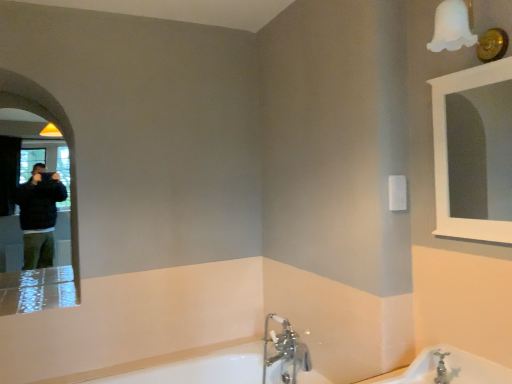
Question: Does white frosted glass light fixture at upper right contain white porcelain bathtub at lower right, the first bath from the top?

Choices:
 (A) no
 (B) yes

Answer: (A)

Question: Is white frosted glass light fixture at upper right looking in the opposite direction of white porcelain bathtub at lower right, placed as the 1th bath when sorted from right to left?

Choices:
 (A) yes
 (B) no

Answer: (B)

Question: Is white frosted glass light fixture at upper right in front of white porcelain bathtub at lower right, placed as the 1th bath when sorted from right to left?

Choices:
 (A) no
 (B) yes

Answer: (A)

Question: Is white frosted glass light fixture at upper right far away from white porcelain bathtub at lower right, positioned as the 1th bath in front-to-back order?

Choices:
 (A) yes
 (B) no

Answer: (A)

Question: From a real-world perspective, is white frosted glass light fixture at upper right physically below white porcelain bathtub at lower right, the 2th bath viewed from the back?

Choices:
 (A) no
 (B) yes

Answer: (A)

Question: From a real-world perspective, is chrome metallic faucet at lower center physically located above or below matte black mirror at left, acting as the 2th mirror starting from the right?

Choices:
 (A) below
 (B) above

Answer: (A)

Question: In terms of width, does chrome metallic faucet at lower center look wider or thinner when compared to matte black mirror at left, which appears as the first mirror when viewed from the back?

Choices:
 (A) thin
 (B) wide

Answer: (A)

Question: In terms of size, does chrome metallic faucet at lower center appear bigger or smaller than matte black mirror at left, the 2th mirror when ordered from front to back?

Choices:
 (A) big
 (B) small

Answer: (B)

Question: Is chrome metallic faucet at lower center in front of or behind matte black mirror at left, the first mirror when ordered from left to right, in the image?

Choices:
 (A) front
 (B) behind

Answer: (B)

Question: From the image's perspective, is white glossy mirror at upper right, which is the first mirror in front-to-back order, positioned above or below white glossy bathtub at lower center, arranged as the 2th bath when viewed from the front?

Choices:
 (A) below
 (B) above

Answer: (B)

Question: Choose the correct answer: Is white glossy mirror at upper right, marked as the second mirror in a left-to-right arrangement, inside white glossy bathtub at lower center, the 2th bath from the top, or outside it?

Choices:
 (A) outside
 (B) inside

Answer: (A)

Question: Based on their sizes in the image, would you say white glossy mirror at upper right, which is the first mirror in front-to-back order, is bigger or smaller than white glossy bathtub at lower center, the 2th bath from the top?

Choices:
 (A) small
 (B) big

Answer: (A)

Question: Is white glossy mirror at upper right, acting as the second mirror starting from the back, in front of or behind white glossy bathtub at lower center, arranged as the 1th bath when ordered from the bottom, in the image?

Choices:
 (A) front
 (B) behind

Answer: (A)

Question: Looking at their shapes, would you say white frosted glass light fixture at upper right is wider or thinner than matte black mirror at left, which appears as the first mirror when viewed from the back?

Choices:
 (A) wide
 (B) thin

Answer: (B)

Question: Considering the positions of white frosted glass light fixture at upper right and matte black mirror at left, the 2th mirror when ordered from front to back, in the image, is white frosted glass light fixture at upper right bigger or smaller than matte black mirror at left, the 2th mirror when ordered from front to back,?

Choices:
 (A) big
 (B) small

Answer: (B)